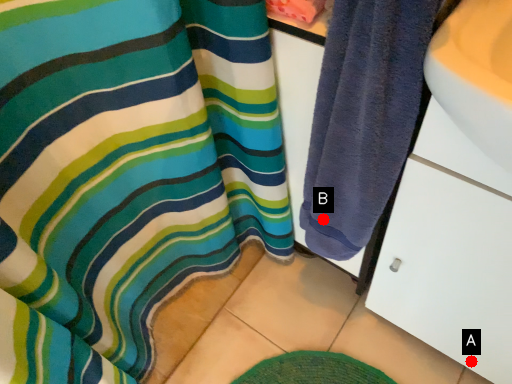
Question: Two points are circled on the image, labeled by A and B beside each circle. Which point is closer to the camera taking this photo?

Choices:
 (A) A is closer
 (B) B is closer

Answer: (B)